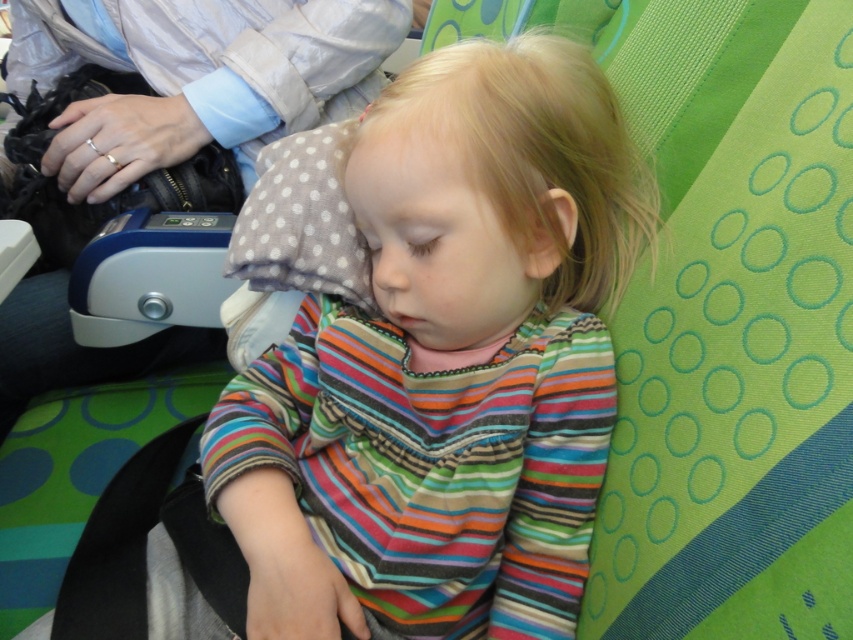
Can you confirm if striped cotton shirt at center is positioned below gray dotted pillow at center?

Indeed, striped cotton shirt at center is positioned under gray dotted pillow at center.

Is point (572, 323) closer to viewer compared to point (337, 268)?

Yes, point (572, 323) is closer to viewer.

Identify the location of striped cotton shirt at center. The width and height of the screenshot is (853, 640). (445, 364).